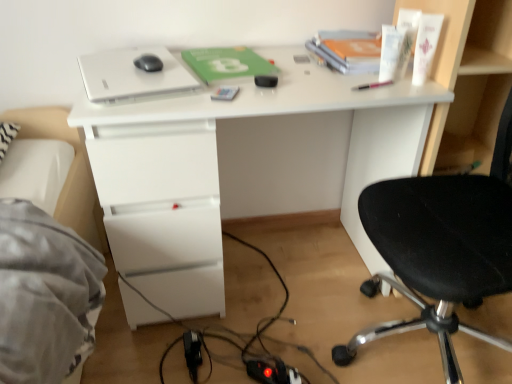
Where is `vacant region in front of metallic silver phone at center, positioned as the 2th stationery in right-to-left order`? vacant region in front of metallic silver phone at center, positioned as the 2th stationery in right-to-left order is located at coordinates (217, 104).